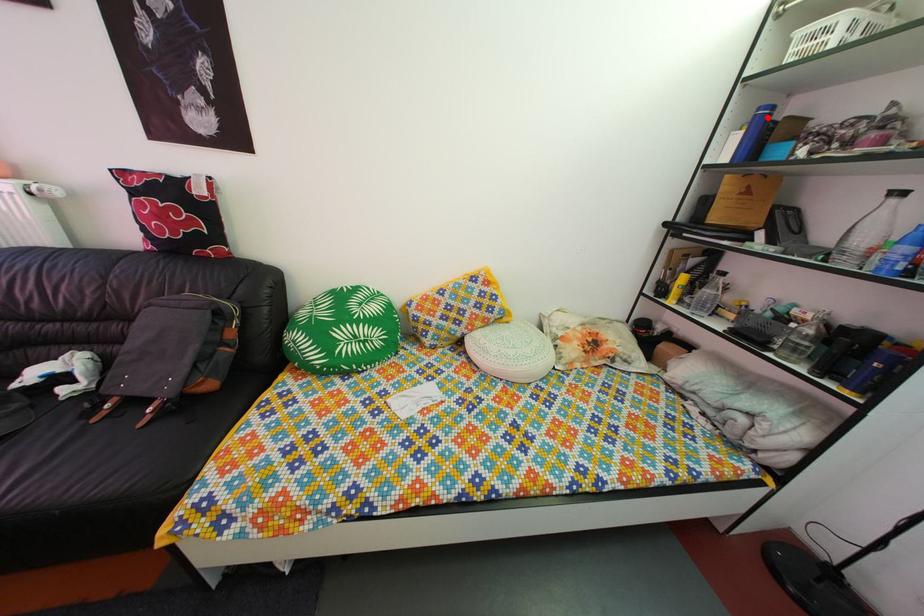
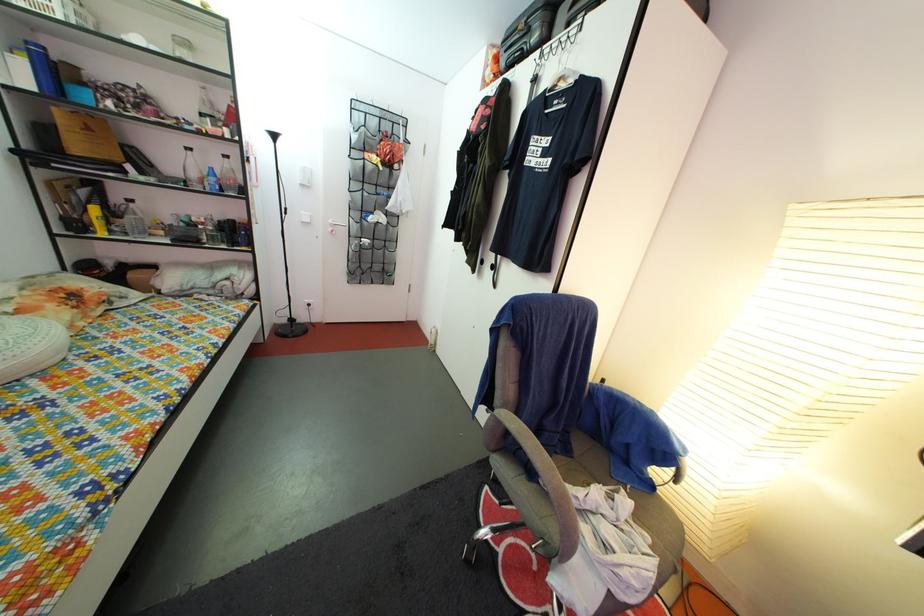
The point at the highlighted location is marked in the first image. Where is the corresponding point in the second image?

(37, 51)